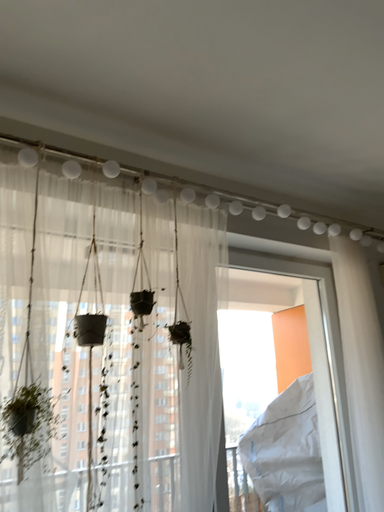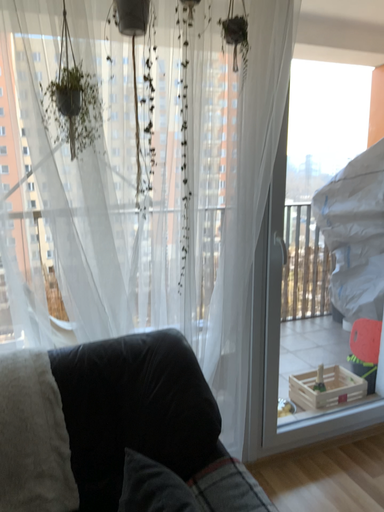
Question: How did the camera likely rotate when shooting the video?

Choices:
 (A) rotated right
 (B) rotated left

Answer: (B)